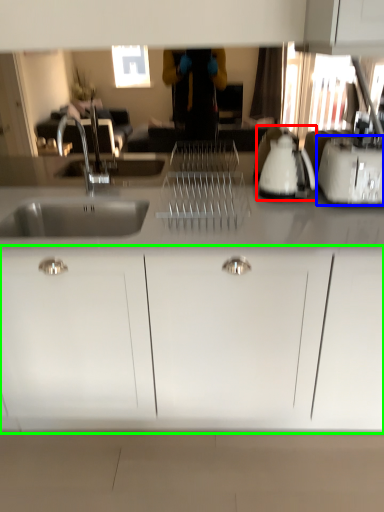
Question: Based on their relative distances, which object is farther from appliance (highlighted by a red box)? Choose from toaster (highlighted by a blue box) and cabinetry (highlighted by a green box).

Choices:
 (A) toaster
 (B) cabinetry

Answer: (B)